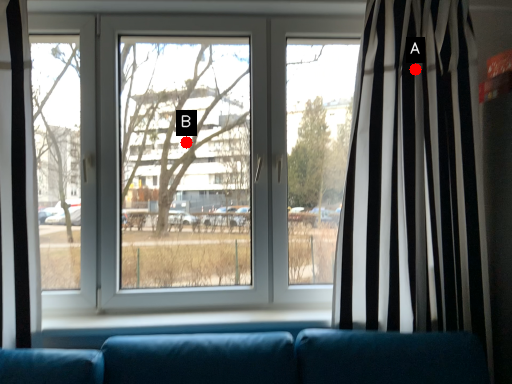
Question: Two points are circled on the image, labeled by A and B beside each circle. Which of the following is the farthest from the observer?

Choices:
 (A) A is further
 (B) B is further

Answer: (B)